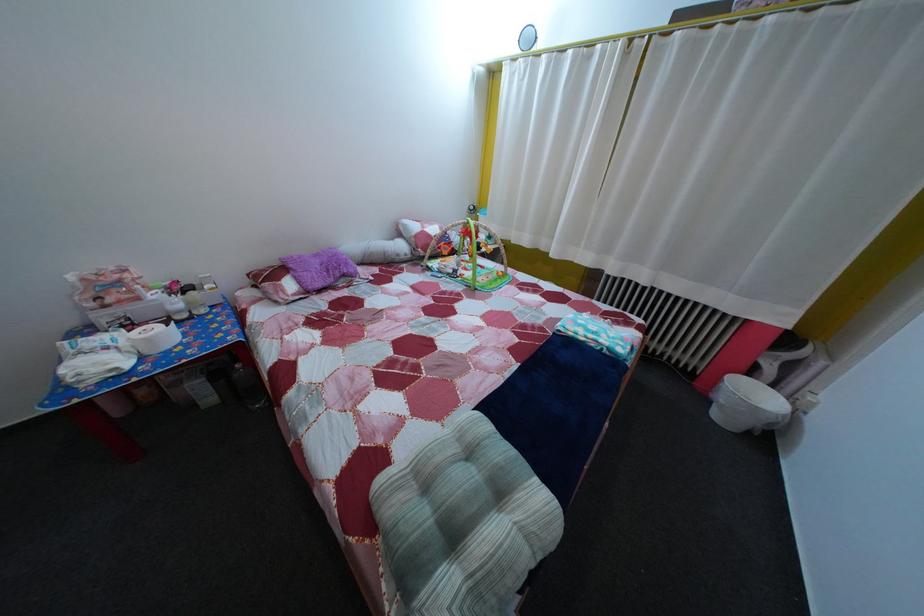
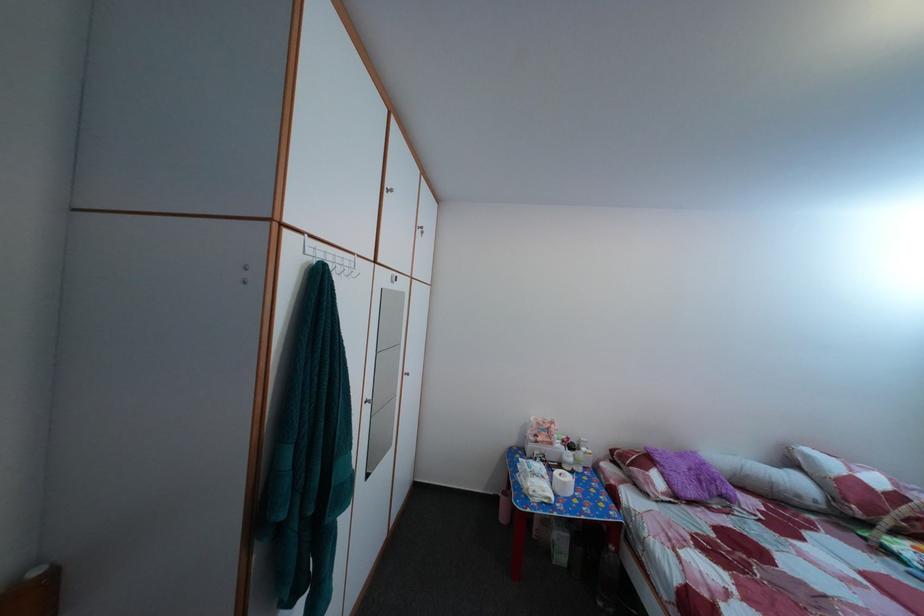
The point at (141, 331) is marked in the first image. Where is the corresponding point in the second image?

(555, 469)